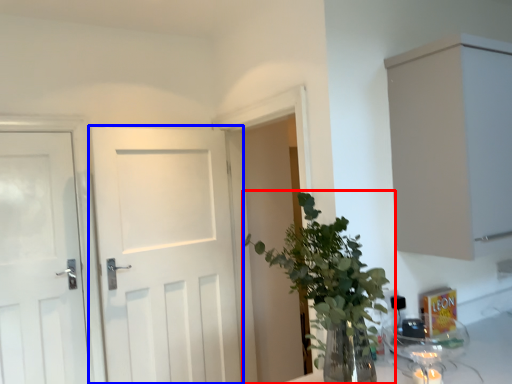
Question: Which object is further to the camera taking this photo, houseplant (highlighted by a red box) or door (highlighted by a blue box)?

Choices:
 (A) houseplant
 (B) door

Answer: (B)